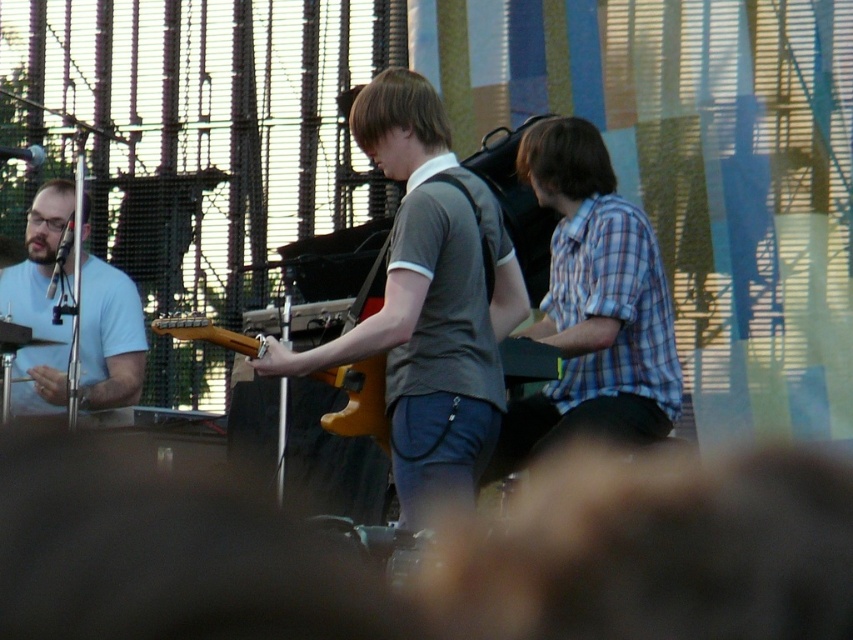
Can you confirm if blue plaid shirt at center is taller than light blue shirt at left?

Indeed, blue plaid shirt at center has a greater height compared to light blue shirt at left.

How much distance is there between blue plaid shirt at center and light blue shirt at left?

A distance of 13.83 meters exists between blue plaid shirt at center and light blue shirt at left.

Which is in front, point (639, 442) or point (65, 404)?

Positioned in front is point (639, 442).

What are the coordinates of `blue plaid shirt at center` in the screenshot? It's located at (593, 305).

Between blue plaid shirt at center and wooden electric guitar at center, which one appears on the right side from the viewer's perspective?

Positioned to the right is blue plaid shirt at center.

Is point (521, 403) more distant than point (149, 326)?

No, it is not.

Is point (602, 394) positioned after point (328, 416)?

Yes, it is.

I want to click on blue plaid shirt at center, so click(593, 305).

How far apart are matte gray shirt at center and light blue shirt at left?

matte gray shirt at center is 13.86 meters away from light blue shirt at left.

Who is more distant from viewer, (509, 243) or (62, 397)?

Positioned behind is point (62, 397).

Does point (421, 340) come in front of point (16, 291)?

Yes, it is in front of point (16, 291).

What are the coordinates of `matte gray shirt at center` in the screenshot? It's located at (428, 301).